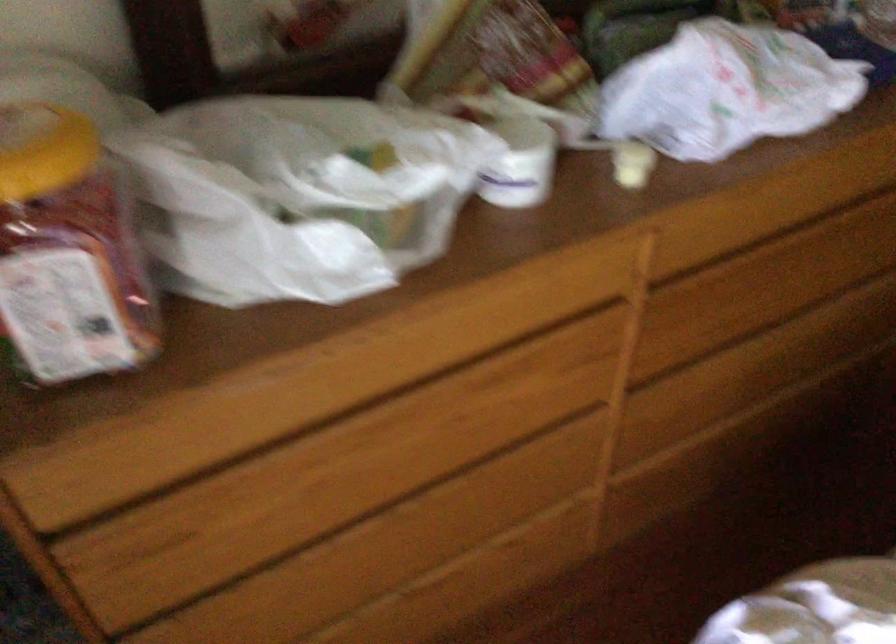
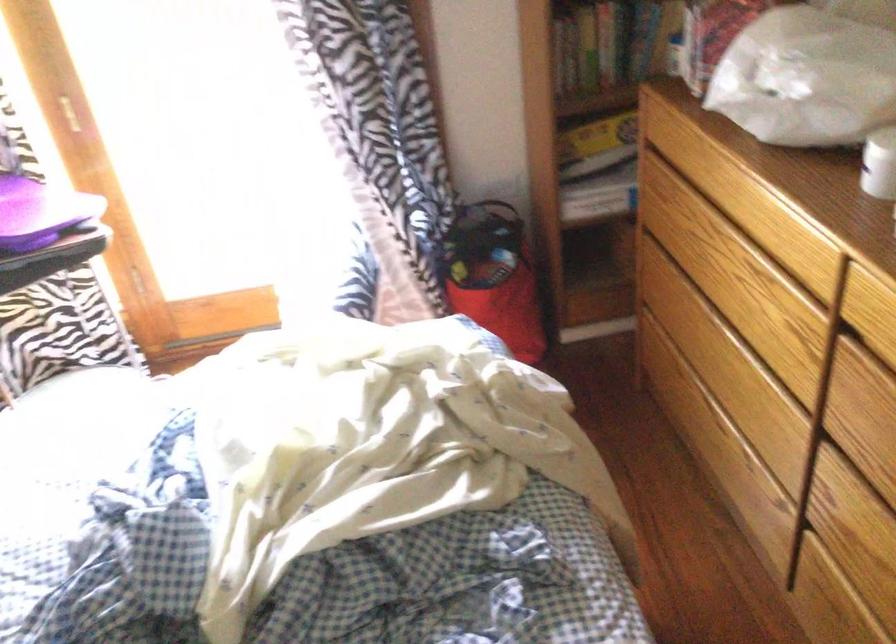
In the second image, find the point that corresponds to point (692, 265) in the first image.

(874, 339)